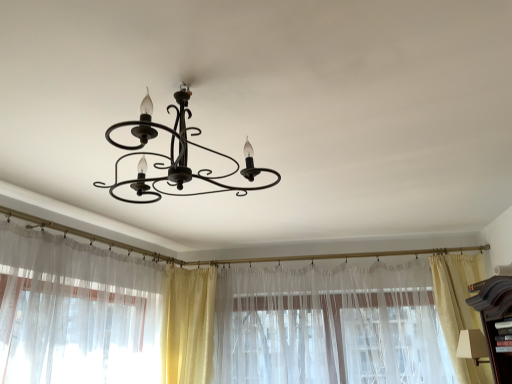
Question: Does beige sheer curtain at right, the fourth curtain when ordered from left to right, have a greater height compared to sheer white curtain at left, arranged as the first curtain when viewed from the left?

Choices:
 (A) no
 (B) yes

Answer: (B)

Question: From the image's perspective, is beige sheer curtain at right, the fourth curtain when ordered from left to right, over sheer white curtain at left, arranged as the first curtain when viewed from the left?

Choices:
 (A) yes
 (B) no

Answer: (B)

Question: Is beige sheer curtain at right, placed as the 1th curtain when sorted from right to left, closer to the viewer compared to sheer white curtain at left, arranged as the first curtain when viewed from the left?

Choices:
 (A) yes
 (B) no

Answer: (B)

Question: Considering the relative sizes of beige sheer curtain at right, the fourth curtain when ordered from left to right, and sheer white curtain at left, arranged as the first curtain when viewed from the left, in the image provided, is beige sheer curtain at right, the fourth curtain when ordered from left to right, wider than sheer white curtain at left, arranged as the first curtain when viewed from the left,?

Choices:
 (A) no
 (B) yes

Answer: (A)

Question: Can you confirm if beige sheer curtain at right, the fourth curtain when ordered from left to right, is smaller than sheer white curtain at left, arranged as the first curtain when viewed from the left?

Choices:
 (A) yes
 (B) no

Answer: (A)

Question: Could you tell me if beige sheer curtain at right, the fourth curtain when ordered from left to right, is facing sheer white curtain at left, arranged as the first curtain when viewed from the left?

Choices:
 (A) yes
 (B) no

Answer: (B)

Question: From a real-world perspective, is silky yellow curtain at center, which is counted as the second curtain, starting from the left, positioned over beige sheer curtain at right, the fourth curtain when ordered from left to right, based on gravity?

Choices:
 (A) yes
 (B) no

Answer: (A)

Question: Is beige sheer curtain at right, placed as the 1th curtain when sorted from right to left, at the back of silky yellow curtain at center, which is counted as the second curtain, starting from the left?

Choices:
 (A) yes
 (B) no

Answer: (B)

Question: Is silky yellow curtain at center, which appears as the third curtain when viewed from the right, at the right side of beige sheer curtain at right, the fourth curtain when ordered from left to right?

Choices:
 (A) no
 (B) yes

Answer: (A)

Question: From the image's perspective, is silky yellow curtain at center, which is counted as the second curtain, starting from the left, under beige sheer curtain at right, the fourth curtain when ordered from left to right?

Choices:
 (A) yes
 (B) no

Answer: (A)

Question: Can you confirm if silky yellow curtain at center, which is counted as the second curtain, starting from the left, is bigger than beige sheer curtain at right, the fourth curtain when ordered from left to right?

Choices:
 (A) yes
 (B) no

Answer: (A)

Question: Is silky yellow curtain at center, which is counted as the second curtain, starting from the left, behind beige sheer curtain at right, the fourth curtain when ordered from left to right?

Choices:
 (A) no
 (B) yes

Answer: (B)

Question: Is sheer white curtain at left, arranged as the first curtain when viewed from the left, behind translucent fabric curtain at center, the 2th curtain when ordered from right to left?

Choices:
 (A) no
 (B) yes

Answer: (A)